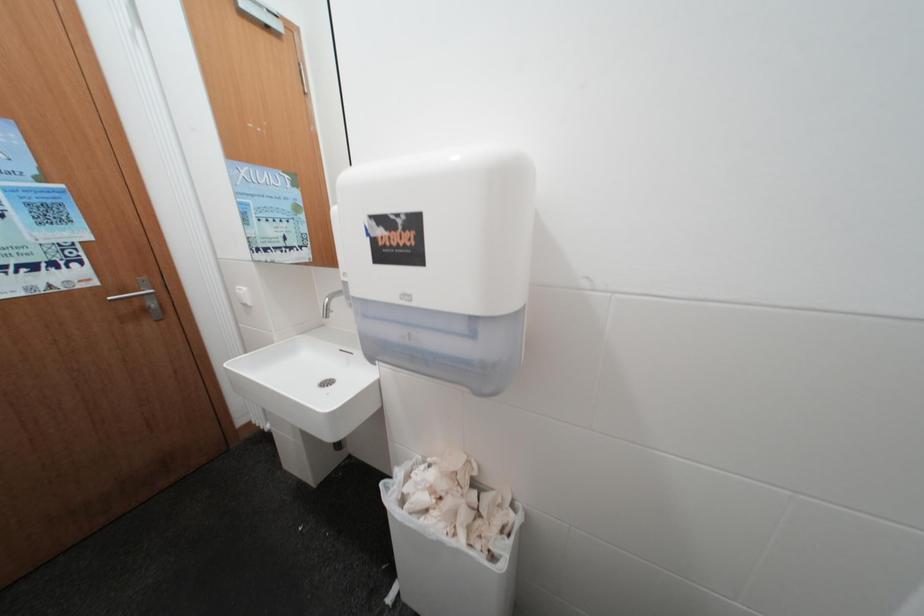
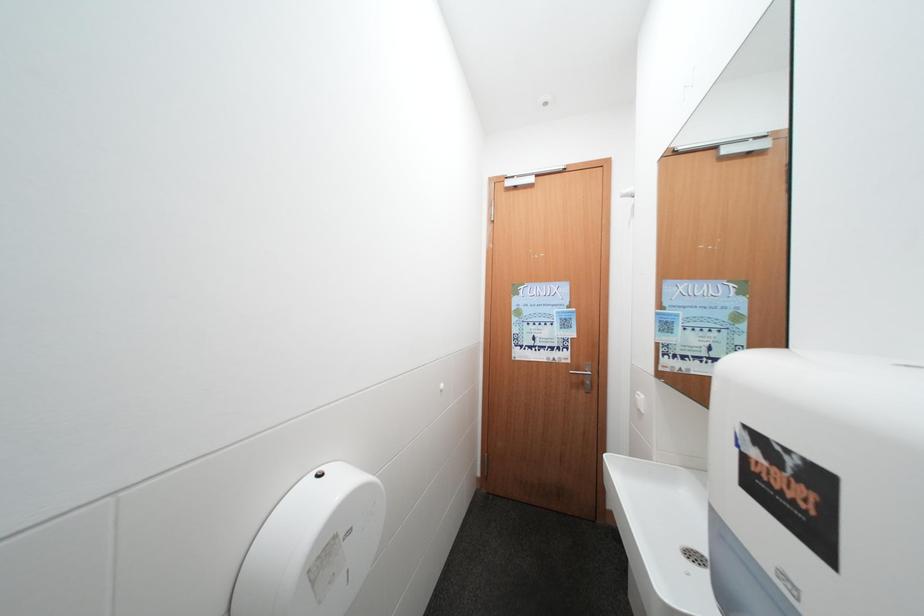
Question: The images are taken continuously from a first-person perspective. In which direction is your viewpoint rotating?

Choices:
 (A) Left
 (B) Right
 (C) Up
 (D) Down

Answer: (A)